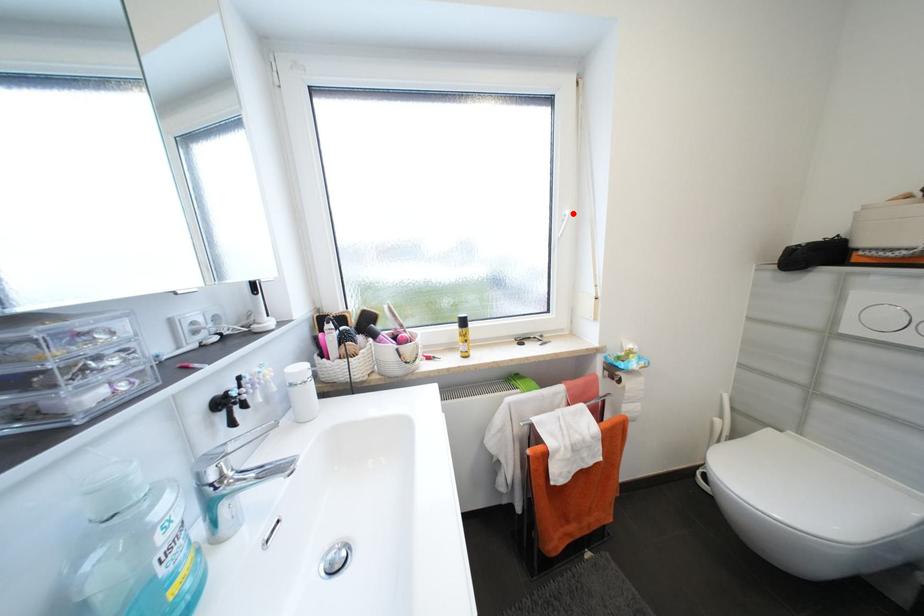
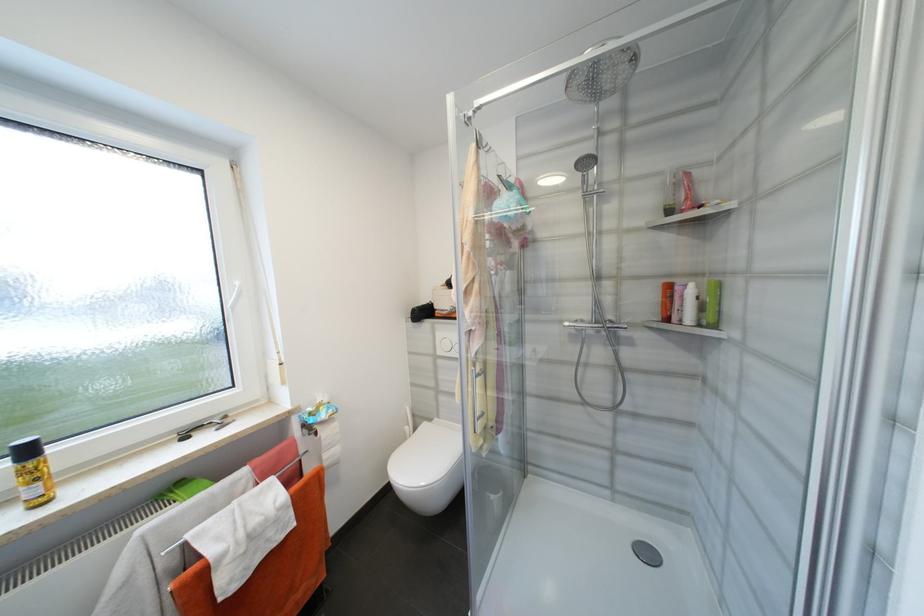
Where in the second image is the point corresponding to the highlighted location from the first image?

(242, 285)